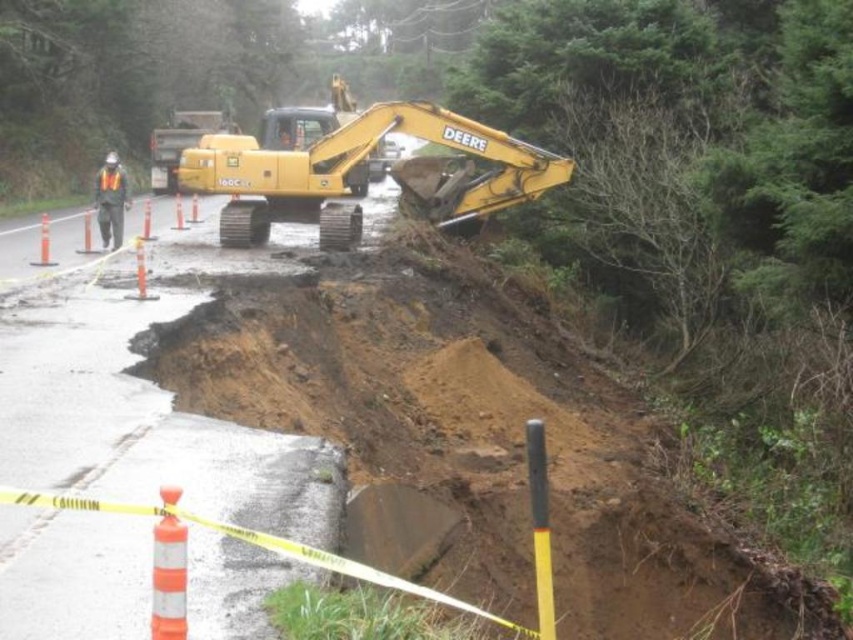
You are a construction worker in the area and need to retrieve the orange reflective vest at left from the yellow rubber excavator at center. Which direction should you move relative to the excavator to reach the vest?

The orange reflective vest at left is on the left side of the yellow rubber excavator at center, so you should move to the left of the excavator to retrieve it.

You are a construction worker standing at the point marked by the coordinates point (357, 170). What object are you standing on?

You are standing on the yellow rubber excavator at center.